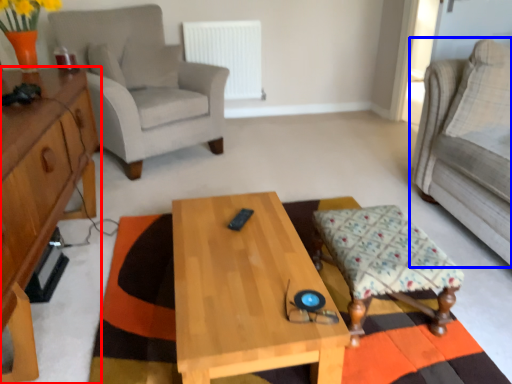
Question: Which object appears closest to the camera in this image, cabinetry (highlighted by a red box) or studio couch (highlighted by a blue box)?

Choices:
 (A) cabinetry
 (B) studio couch

Answer: (A)